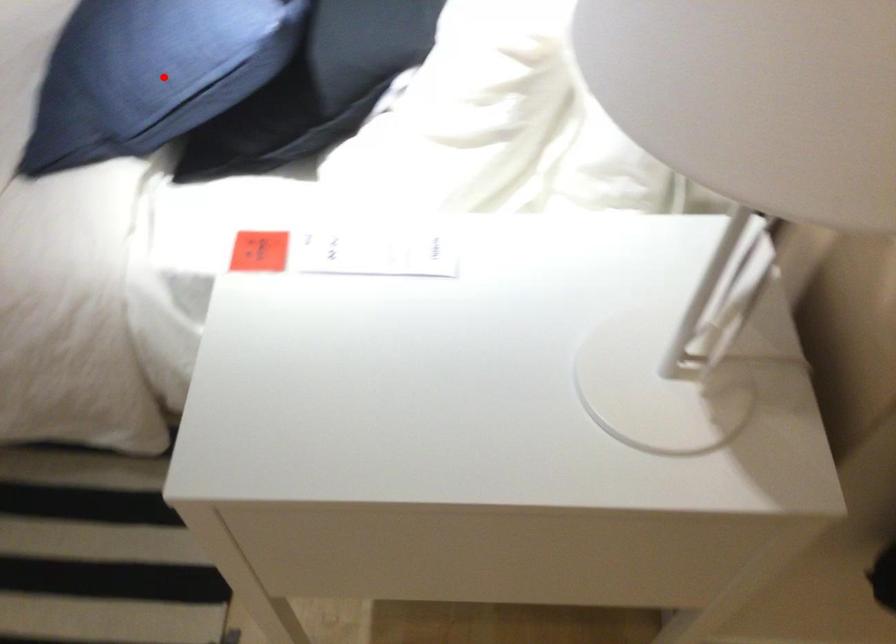
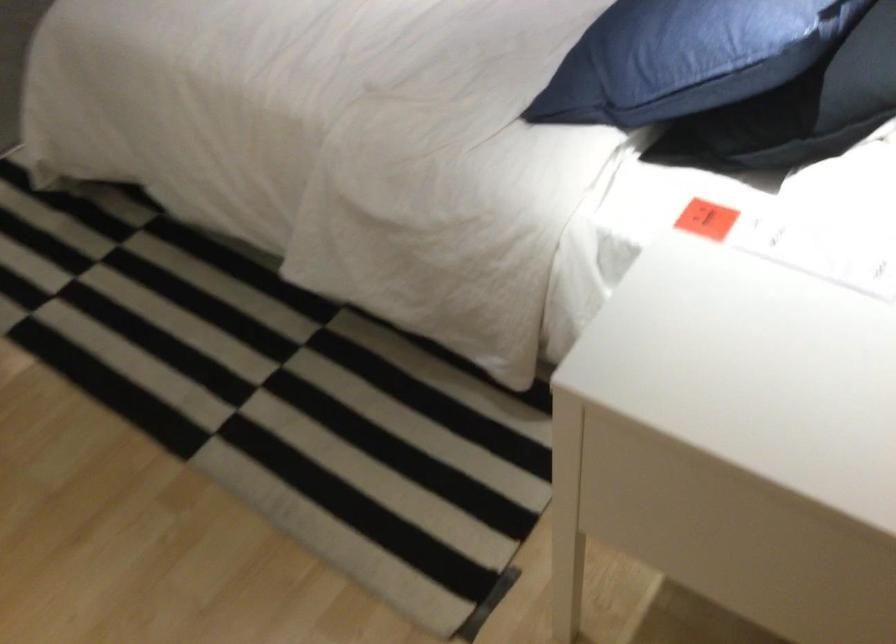
Question: I am providing you with two images of the same scene from different viewpoints. A red point is marked on the first image. Can you still see the location of the red point in image 2?

Choices:
 (A) Yes
 (B) No

Answer: (A)